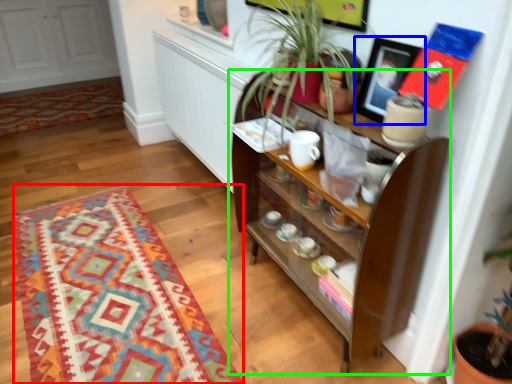
Question: Considering the real-world distances, which object is farthest from mat (highlighted by a red box)? picture frame (highlighted by a blue box) or shelf (highlighted by a green box)?

Choices:
 (A) picture frame
 (B) shelf

Answer: (A)